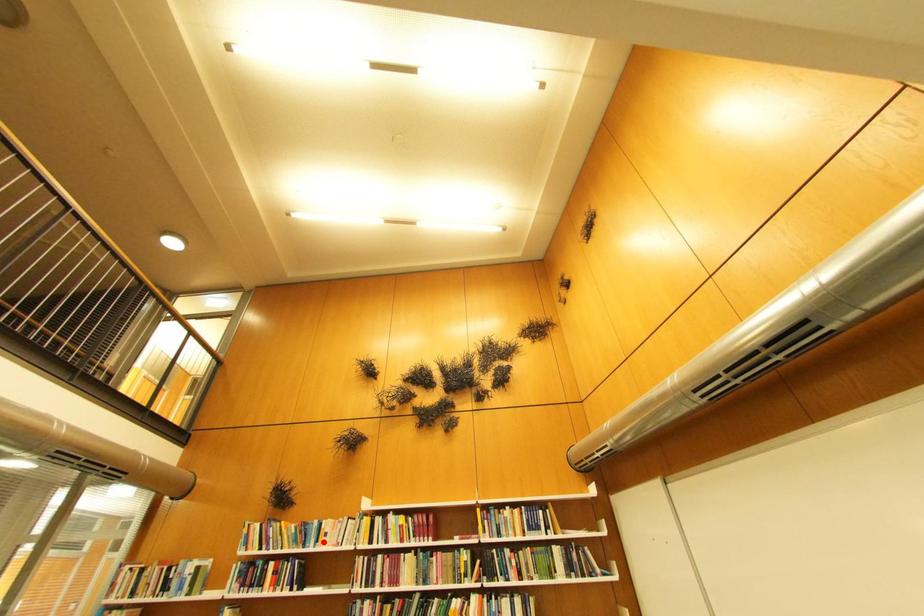
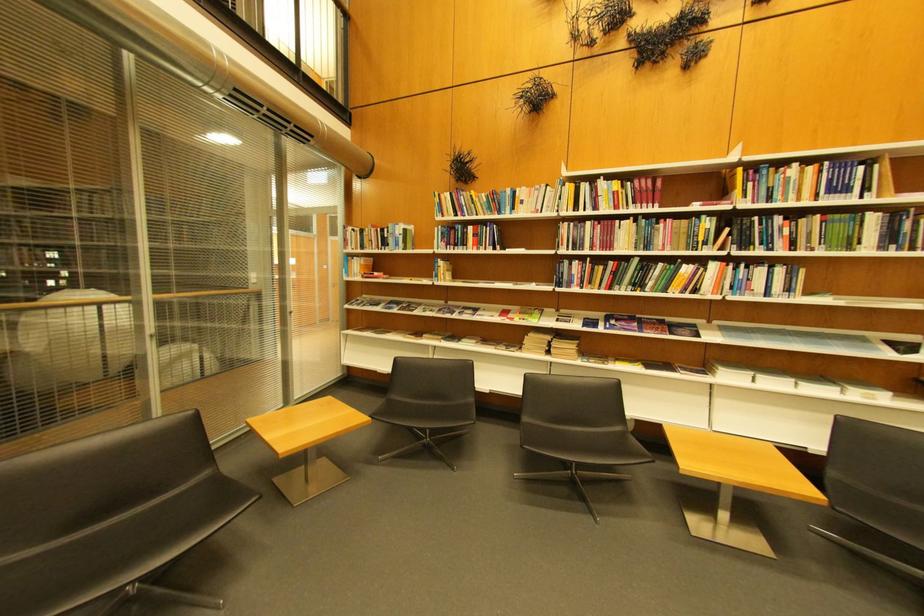
The point at the highlighted location is marked in the first image. Where is the corresponding point in the second image?

(518, 209)